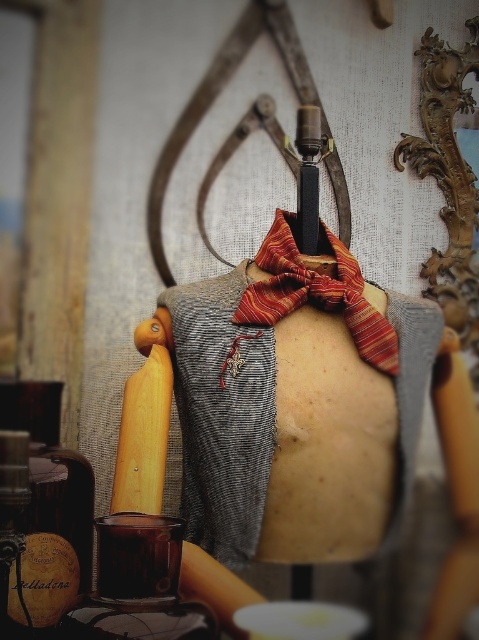
Based on the photo, based on the coordinates provided, where exactly is the striped silk bow at center located in the image?

The striped silk bow at center is located at the coordinates point (316, 292).

You are an interior designer assessing the vintage display. You need to determine the spatial relationship between the striped silk bow at center and the wooden rolling pin at left. Which object is closer to the viewer?

The striped silk bow at center is closer to the viewer than the wooden rolling pin at left.

You are a tailor working in this vintage setting. You need to place a new fabric roll that is 1 meter wide. Which object, the striped silk bow at center or the wooden rolling pin at left, would allow the fabric roll to fit beside it without overlapping?

The striped silk bow at center has a larger width than the wooden rolling pin at left. Since the fabric roll is 1 meter wide, it would require more space. Therefore, placing it beside the wooden rolling pin at left, which is narrower, would allow the fabric roll to fit without overlapping.